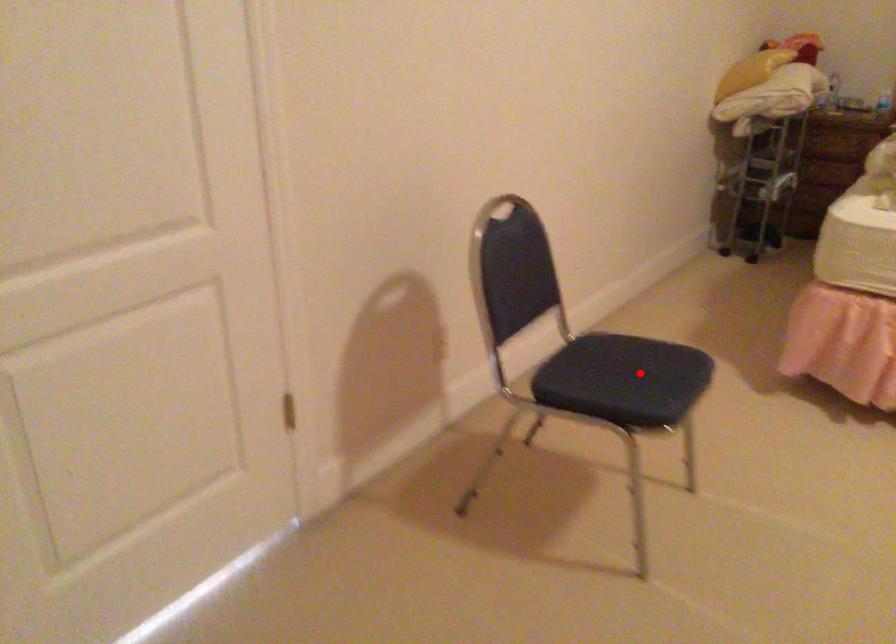
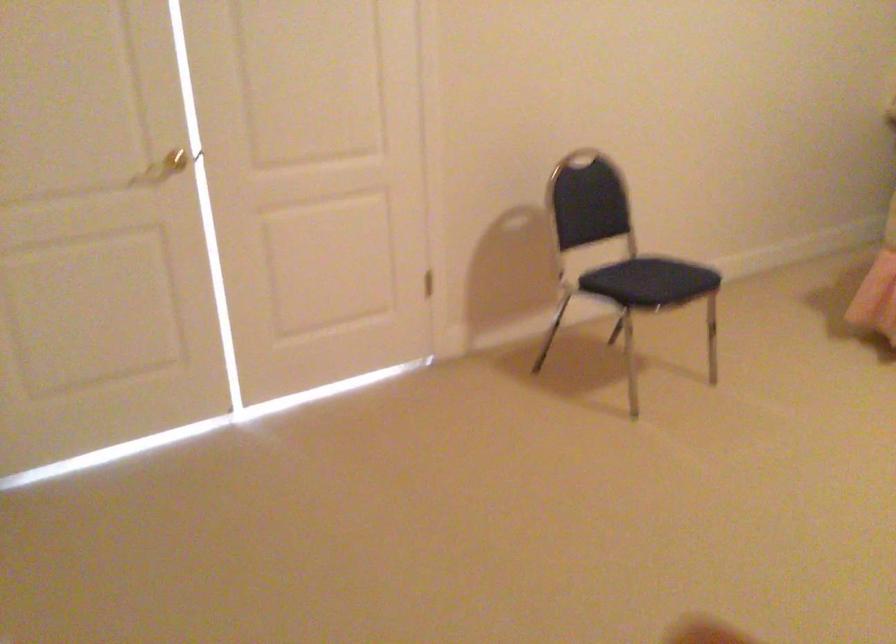
Find the pixel in the second image that matches the highlighted location in the first image.

(657, 276)